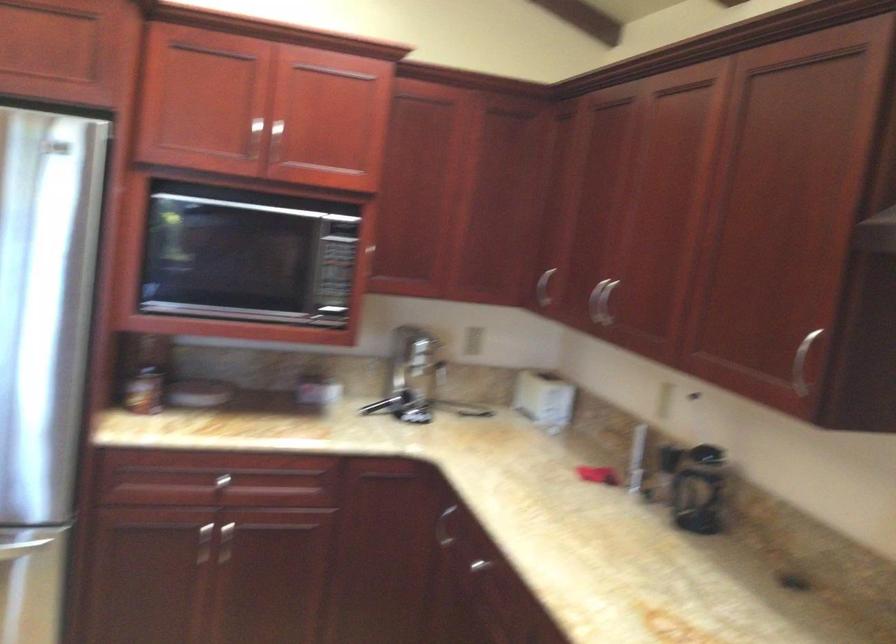
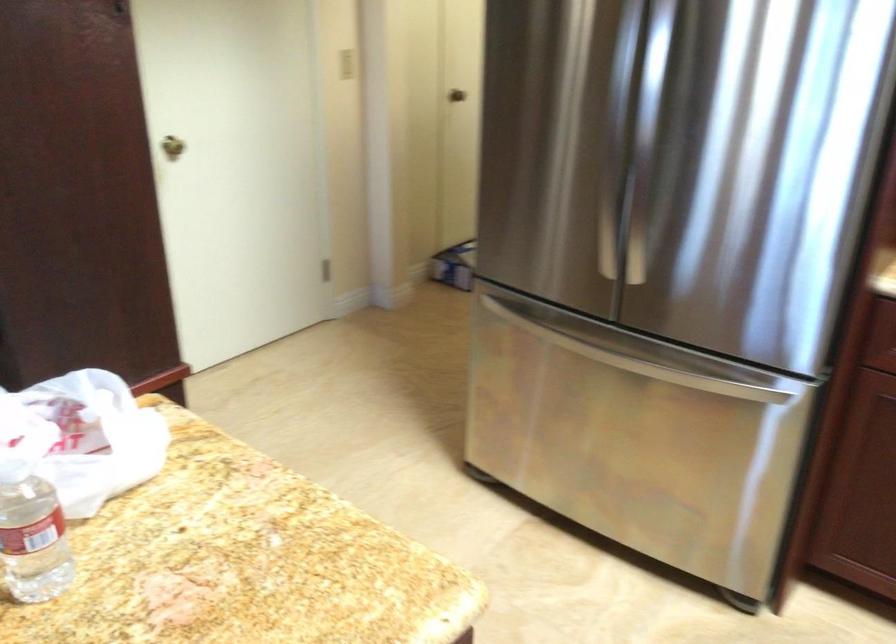
Question: Based on the continuous images, in which direction is the camera rotating? Reply with the corresponding letter.

Choices:
 (A) Left
 (B) Right
 (C) Up
 (D) Down

Answer: (A)